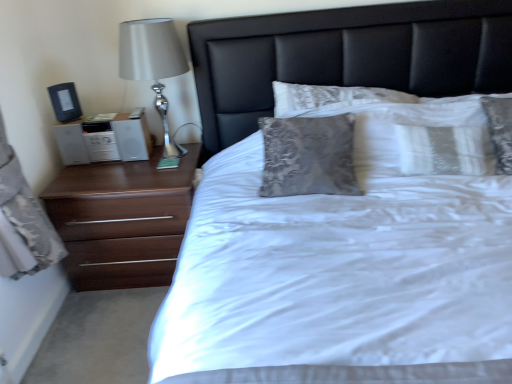
Question: From a real-world perspective, does black leather headboard at center stand above white satin bed at center?

Choices:
 (A) yes
 (B) no

Answer: (A)

Question: Can you confirm if black leather headboard at center is smaller than white satin bed at center?

Choices:
 (A) yes
 (B) no

Answer: (A)

Question: Is black leather headboard at center shorter than white satin bed at center?

Choices:
 (A) no
 (B) yes

Answer: (B)

Question: Is black leather headboard at center directly adjacent to white satin bed at center?

Choices:
 (A) no
 (B) yes

Answer: (A)

Question: Is black leather headboard at center not inside white satin bed at center?

Choices:
 (A) no
 (B) yes

Answer: (A)

Question: From a real-world perspective, is brown wood chest of drawers at left positioned above or below silver metallic table lamp at left?

Choices:
 (A) below
 (B) above

Answer: (A)

Question: From the image's perspective, is brown wood chest of drawers at left located above or below silver metallic table lamp at left?

Choices:
 (A) above
 (B) below

Answer: (B)

Question: Considering the positions of brown wood chest of drawers at left and silver metallic table lamp at left in the image, is brown wood chest of drawers at left taller or shorter than silver metallic table lamp at left?

Choices:
 (A) short
 (B) tall

Answer: (A)

Question: Is point (140, 253) positioned closer to the camera than point (166, 127)?

Choices:
 (A) farther
 (B) closer

Answer: (B)

Question: Would you say white glossy nightstand at left is inside or outside white satin bed at center?

Choices:
 (A) inside
 (B) outside

Answer: (B)

Question: In terms of width, does white glossy nightstand at left look wider or thinner when compared to white satin bed at center?

Choices:
 (A) thin
 (B) wide

Answer: (A)

Question: From a real-world perspective, is white glossy nightstand at left positioned above or below white satin bed at center?

Choices:
 (A) below
 (B) above

Answer: (B)

Question: From the image's perspective, is white glossy nightstand at left above or below white satin bed at center?

Choices:
 (A) above
 (B) below

Answer: (A)

Question: From the image's perspective, is brown wood chest of drawers at left positioned above or below white satin bed at center?

Choices:
 (A) below
 (B) above

Answer: (A)

Question: Visually, is brown wood chest of drawers at left positioned to the left or to the right of white satin bed at center?

Choices:
 (A) left
 (B) right

Answer: (A)